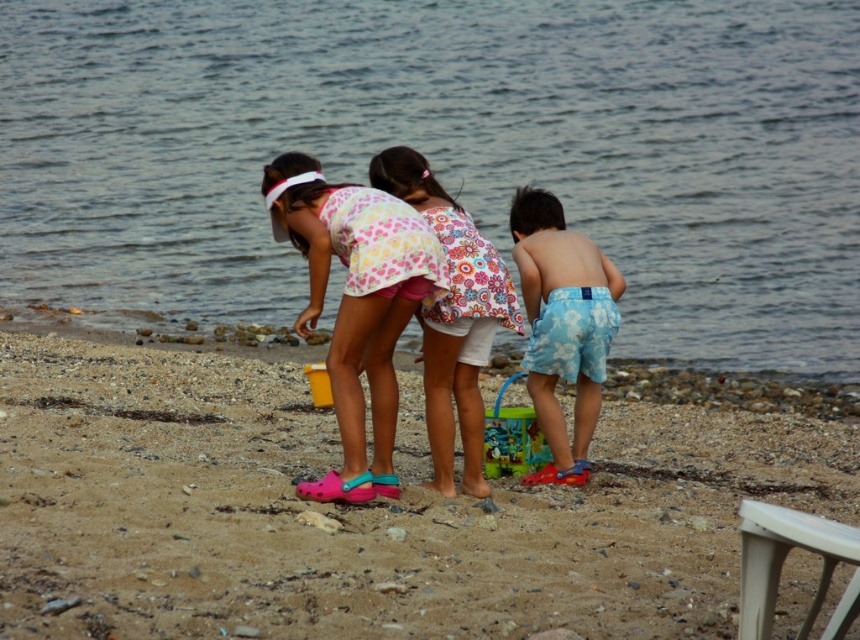
Question: Is pink crocs at center positioned at the back of blue floral shorts at right?

Choices:
 (A) no
 (B) yes

Answer: (A)

Question: Can you confirm if pink crocs at center is positioned above yellow plastic bucket at center?

Choices:
 (A) no
 (B) yes

Answer: (B)

Question: Which point appears farthest from the camera in this image?

Choices:
 (A) pos(688,596)
 (B) pos(387,429)

Answer: (B)

Question: Among these objects, which one is nearest to the camera?

Choices:
 (A) brown sandy beach at center
 (B) floral fabric dress at center
 (C) pink crocs at center
 (D) white plastic stool at lower right

Answer: (D)

Question: Which is farther from the yellow plastic bucket at center?

Choices:
 (A) blue floral shorts at right
 (B) floral fabric dress at center
 (C) white plastic stool at lower right

Answer: (C)

Question: Can you confirm if clear blue water at center is wider than floral fabric dress at center?

Choices:
 (A) no
 (B) yes

Answer: (B)